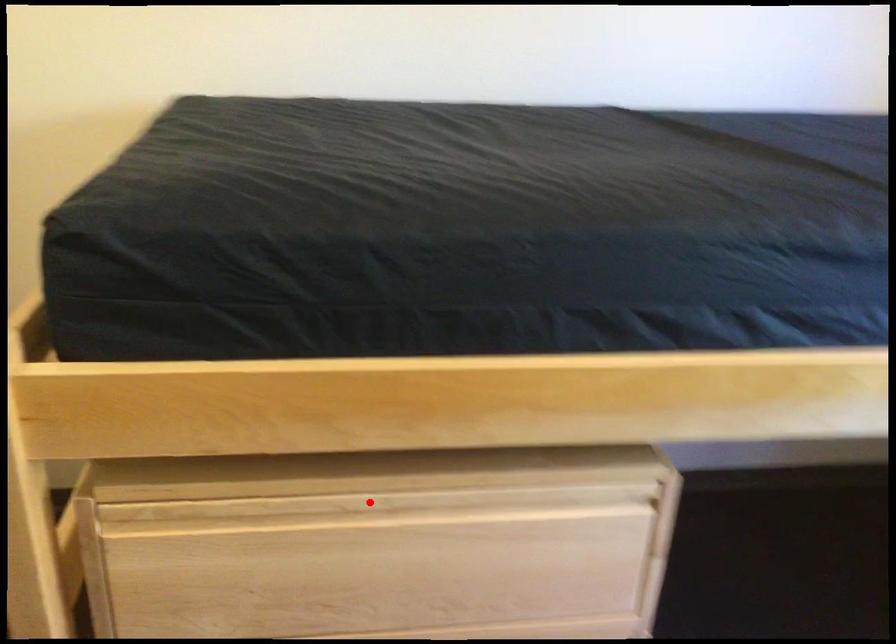
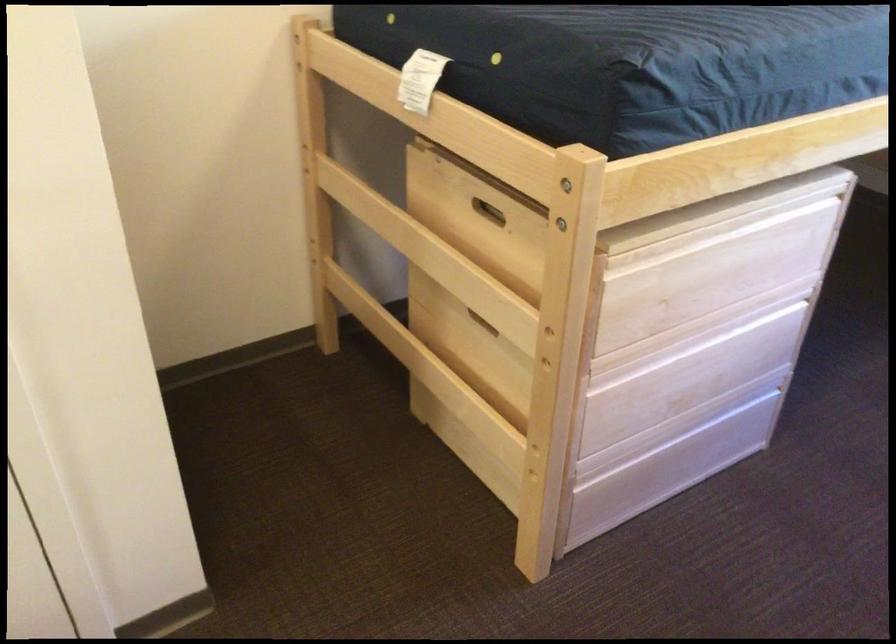
Question: A red point is marked in image1. In image2, is the corresponding 3D point closer to the camera or farther? Reply with the corresponding letter.

Choices:
 (A) The corresponding 3D point is closer.
 (B) The corresponding 3D point is farther.

Answer: (B)